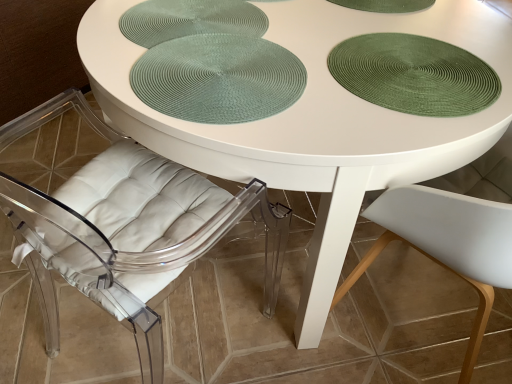
This screenshot has height=384, width=512. Find the location of `vacant area that lies between green textured placemat at upper right, which is the 1th glass plate in right-to-left order, and green woven placemat at center`. vacant area that lies between green textured placemat at upper right, which is the 1th glass plate in right-to-left order, and green woven placemat at center is located at coordinates (314, 74).